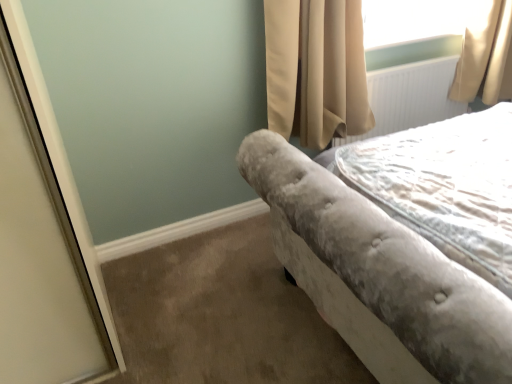
Question: Does beige velvet curtain at upper right turn towards white textured radiator at upper right?

Choices:
 (A) yes
 (B) no

Answer: (B)

Question: Is beige velvet curtain at upper right shorter than white textured radiator at upper right?

Choices:
 (A) yes
 (B) no

Answer: (B)

Question: Is there a large distance between beige velvet curtain at upper right and white textured radiator at upper right?

Choices:
 (A) yes
 (B) no

Answer: (B)

Question: Is white textured radiator at upper right completely or partially inside beige velvet curtain at upper right?

Choices:
 (A) yes
 (B) no

Answer: (B)

Question: Does beige velvet curtain at upper right have a lesser width compared to white textured radiator at upper right?

Choices:
 (A) yes
 (B) no

Answer: (B)

Question: Does beige velvet curtain at upper right have a smaller size compared to white textured radiator at upper right?

Choices:
 (A) yes
 (B) no

Answer: (B)

Question: Does white textured radiator at upper right turn towards velvet gray bed at right?

Choices:
 (A) yes
 (B) no

Answer: (A)

Question: Is white textured radiator at upper right shorter than velvet gray bed at right?

Choices:
 (A) yes
 (B) no

Answer: (A)

Question: Is white textured radiator at upper right taller than velvet gray bed at right?

Choices:
 (A) yes
 (B) no

Answer: (B)

Question: Is white textured radiator at upper right directly adjacent to velvet gray bed at right?

Choices:
 (A) yes
 (B) no

Answer: (B)

Question: Is velvet gray bed at right surrounded by white textured radiator at upper right?

Choices:
 (A) yes
 (B) no

Answer: (B)

Question: Can you confirm if white textured radiator at upper right is wider than velvet gray bed at right?

Choices:
 (A) no
 (B) yes

Answer: (A)

Question: Is beige velvet curtain at upper right to the right of velvet gray bedspread at right from the viewer's perspective?

Choices:
 (A) yes
 (B) no

Answer: (B)